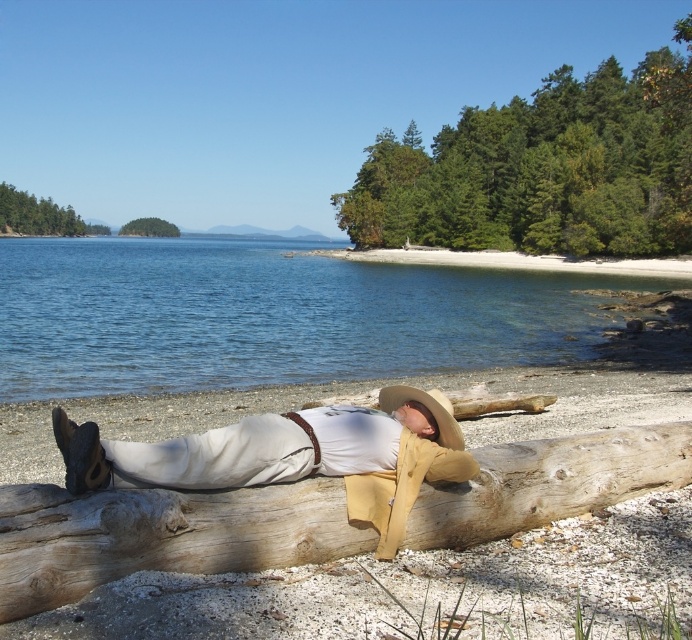
Is clear blue water at center below light brown leather hat at center?

Incorrect, clear blue water at center is not positioned below light brown leather hat at center.

Image resolution: width=692 pixels, height=640 pixels. I want to click on clear blue water at center, so click(x=268, y=316).

Does clear blue water at center appear over light brown wood log at center?

Correct, clear blue water at center is located above light brown wood log at center.

Locate an element on the screen. This screenshot has height=640, width=692. clear blue water at center is located at coordinates (268, 316).

You are a GUI agent. You are given a task and a screenshot of the screen. Output one action in this format:
    pyautogui.click(x=<x>, y=<y>)
    Task: Click on the clear blue water at center
    The width and height of the screenshot is (692, 640).
    Given the screenshot: What is the action you would take?
    pyautogui.click(x=268, y=316)

Can you confirm if clear blue water at center is positioned below beige straw cowboy hat at center?

No.

In the scene shown: Who is higher up, clear blue water at center or beige straw cowboy hat at center?

clear blue water at center

The image size is (692, 640). What do you see at coordinates (268, 316) in the screenshot?
I see `clear blue water at center` at bounding box center [268, 316].

You are a GUI agent. You are given a task and a screenshot of the screen. Output one action in this format:
    pyautogui.click(x=<x>, y=<y>)
    Task: Click on the clear blue water at center
    The image size is (692, 640).
    Given the screenshot: What is the action you would take?
    pyautogui.click(x=268, y=316)